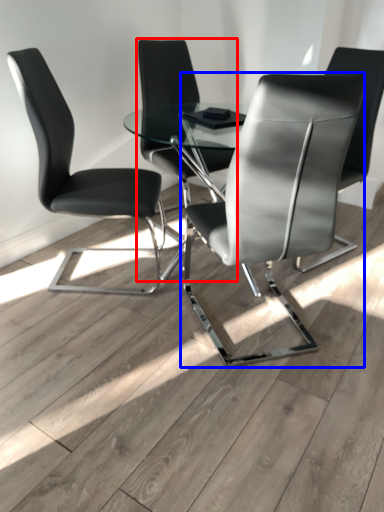
Question: Which object appears closest to the camera in this image, chair (highlighted by a red box) or chair (highlighted by a blue box)?

Choices:
 (A) chair
 (B) chair

Answer: (B)